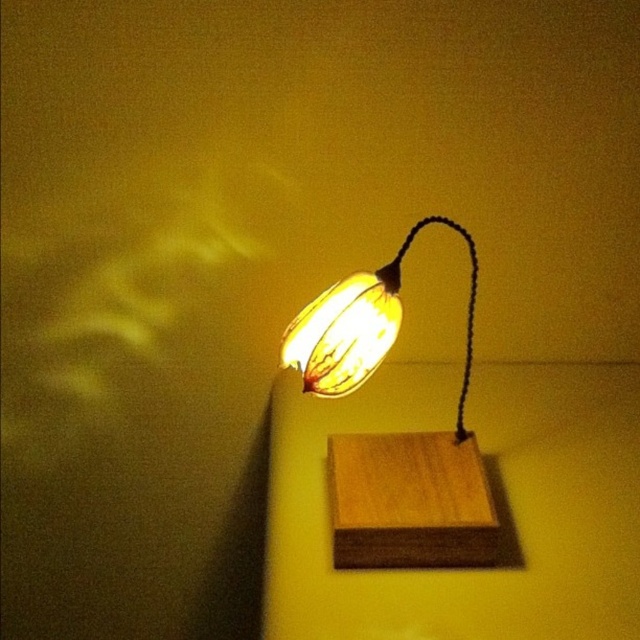
Who is shorter, wooden table lamp at center or matte yellow lampshade at center?

Standing shorter between the two is matte yellow lampshade at center.

Can you confirm if wooden table lamp at center is positioned to the right of matte yellow lampshade at center?

Yes, wooden table lamp at center is to the right of matte yellow lampshade at center.

Is point (358, 337) closer to viewer compared to point (358, 356)?

Yes, point (358, 337) is in front of point (358, 356).

Locate an element on the screen. The image size is (640, 640). wooden table lamp at center is located at coordinates (392, 435).